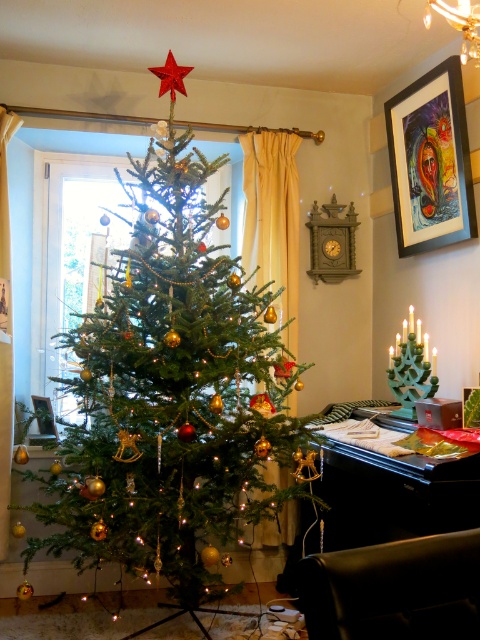
Is green matte christmas tree at center shorter than metallic gold picture frame at center?

No.

Between green matte christmas tree at center and metallic gold picture frame at center, which one has less height?

metallic gold picture frame at center

Locate an element on the screen. green matte christmas tree at center is located at coordinates (171, 394).

How far apart are black polished piano at lower center and metallic gold picture frame at center?

black polished piano at lower center and metallic gold picture frame at center are 53.62 centimeters apart.

Does black polished piano at lower center appear on the right side of metallic gold picture frame at center?

Incorrect, black polished piano at lower center is not on the right side of metallic gold picture frame at center.

Is point (354, 456) positioned in front of point (468, 424)?

That is False.

Locate an element on the screen. black polished piano at lower center is located at coordinates (394, 496).

Is green matte christmas tree at center positioned in front of brushed metal picture frame at lower left?

Yes, it is.

Which is more to the right, green matte christmas tree at center or brushed metal picture frame at lower left?

From the viewer's perspective, green matte christmas tree at center appears more on the right side.

The width and height of the screenshot is (480, 640). What do you see at coordinates (171, 394) in the screenshot?
I see `green matte christmas tree at center` at bounding box center [171, 394].

Locate an element on the screen. The height and width of the screenshot is (640, 480). green matte christmas tree at center is located at coordinates (171, 394).